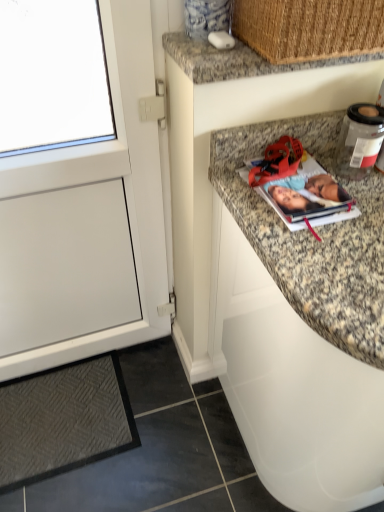
Question: Considering the relative sizes of woven straw basket at upper right and granite countertop at upper center in the image provided, is woven straw basket at upper right thinner than granite countertop at upper center?

Choices:
 (A) no
 (B) yes

Answer: (A)

Question: Does woven straw basket at upper right touch granite countertop at upper center?

Choices:
 (A) no
 (B) yes

Answer: (B)

Question: From a real-world perspective, is woven straw basket at upper right on granite countertop at upper center?

Choices:
 (A) yes
 (B) no

Answer: (A)

Question: Is there a large distance between woven straw basket at upper right and granite countertop at upper center?

Choices:
 (A) yes
 (B) no

Answer: (B)

Question: Is woven straw basket at upper right facing away from granite countertop at upper center?

Choices:
 (A) no
 (B) yes

Answer: (A)

Question: From a real-world perspective, is woven straw basket at upper right positioned under granite countertop at upper center based on gravity?

Choices:
 (A) no
 (B) yes

Answer: (A)

Question: Does granite countertop at upper center appear on the left side of matte paper photo album at upper right?

Choices:
 (A) yes
 (B) no

Answer: (A)

Question: From a real-world perspective, is granite countertop at upper center below matte paper photo album at upper right?

Choices:
 (A) yes
 (B) no

Answer: (B)

Question: Can you confirm if granite countertop at upper center is shorter than matte paper photo album at upper right?

Choices:
 (A) no
 (B) yes

Answer: (A)

Question: Considering the relative sizes of granite countertop at upper center and matte paper photo album at upper right in the image provided, is granite countertop at upper center taller than matte paper photo album at upper right?

Choices:
 (A) yes
 (B) no

Answer: (A)

Question: Is granite countertop at upper center facing towards matte paper photo album at upper right?

Choices:
 (A) yes
 (B) no

Answer: (B)

Question: Is granite countertop at upper center positioned beyond the bounds of matte paper photo album at upper right?

Choices:
 (A) no
 (B) yes

Answer: (B)

Question: From the image's perspective, is white matte cabinet at left, the 1th cabinetry when ordered from left to right, located beneath granite countertop at upper right, the first cabinetry positioned from the right?

Choices:
 (A) no
 (B) yes

Answer: (A)